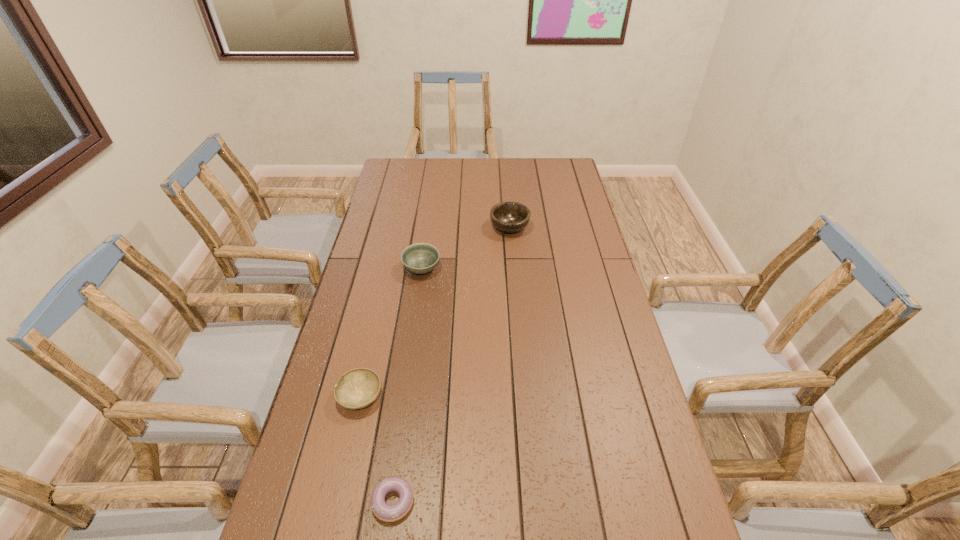
What are the coordinates of `the farthest bowl` in the screenshot? It's located at (510, 217).

At what (x,y) coordinates should I click in order to perform the action: click on the rightmost object. Please return your answer as a coordinate pair (x, y). This screenshot has width=960, height=540. Looking at the image, I should click on (510, 217).

Where is `the second nearest bowl`? the second nearest bowl is located at coordinates (420, 258).

Where is `the nearest bowl`? This screenshot has height=540, width=960. the nearest bowl is located at coordinates [x=358, y=388].

Find the location of `the shortest bowl`. the shortest bowl is located at coordinates (358, 388).

Where is `doughnut`? The height and width of the screenshot is (540, 960). doughnut is located at coordinates (389, 513).

Find the location of a particular element. the shortest object is located at coordinates (389, 513).

Where is `vacant region located on the left of the farthest bowl`? The image size is (960, 540). vacant region located on the left of the farthest bowl is located at coordinates (412, 228).

Image resolution: width=960 pixels, height=540 pixels. Find the location of `vacant space located on the back of the second nearest bowl`. vacant space located on the back of the second nearest bowl is located at coordinates (428, 221).

Where is `vacant space located on the front of the third tallest object`? vacant space located on the front of the third tallest object is located at coordinates (339, 492).